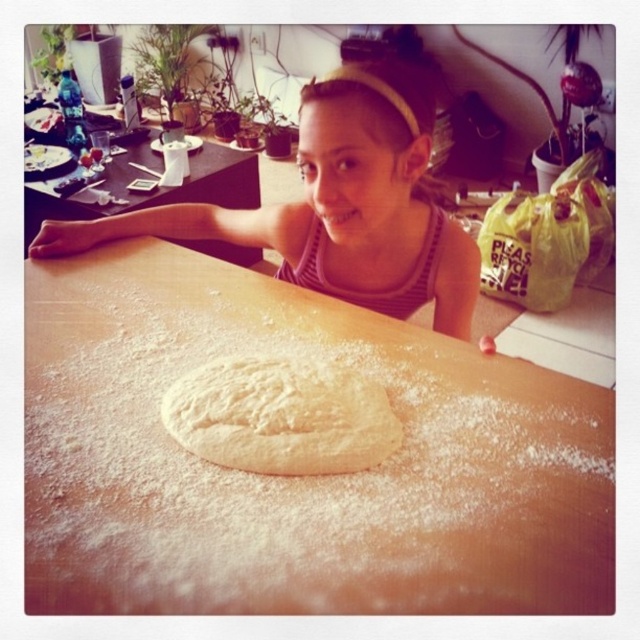
From the picture: Can you confirm if wooden at center is thinner than wooden table at upper left?

Correct, wooden at center's width is less than wooden table at upper left's.

Does wooden at center appear on the left side of wooden table at upper left?

Incorrect, wooden at center is not on the left side of wooden table at upper left.

Describe the element at coordinates (296, 477) in the screenshot. The width and height of the screenshot is (640, 640). I see `wooden at center` at that location.

In order to click on wooden at center in this screenshot , I will do `click(296, 477)`.

Does pink striped tank top at upper center appear under wooden table at upper left?

Correct, pink striped tank top at upper center is located below wooden table at upper left.

Is point (339, 134) farther from viewer compared to point (29, 232)?

That is False.

Find the location of a particular element. pink striped tank top at upper center is located at coordinates (337, 204).

Is white dough at center positioned at the back of wooden table at upper left?

No, it is not.

Does point (244, 426) lie behind point (131, 205)?

No, it is in front of (131, 205).

Which is behind, point (365, 392) or point (209, 193)?

Point (209, 193)

At what (x,y) coordinates should I click in order to perform the action: click on white dough at center. Please return your answer as a coordinate pair (x, y). The height and width of the screenshot is (640, 640). Looking at the image, I should click on (282, 417).